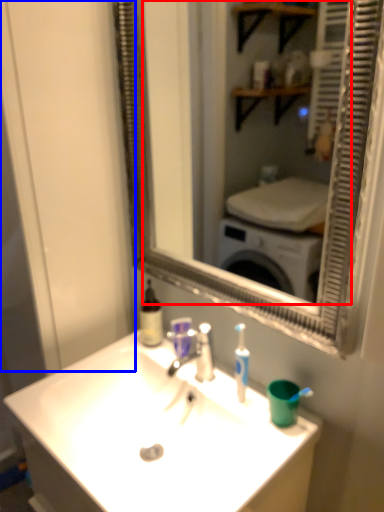
Question: Among these objects, which one is nearest to the camera, mirror (highlighted by a red box) or glass door (highlighted by a blue box)?

Choices:
 (A) mirror
 (B) glass door

Answer: (A)